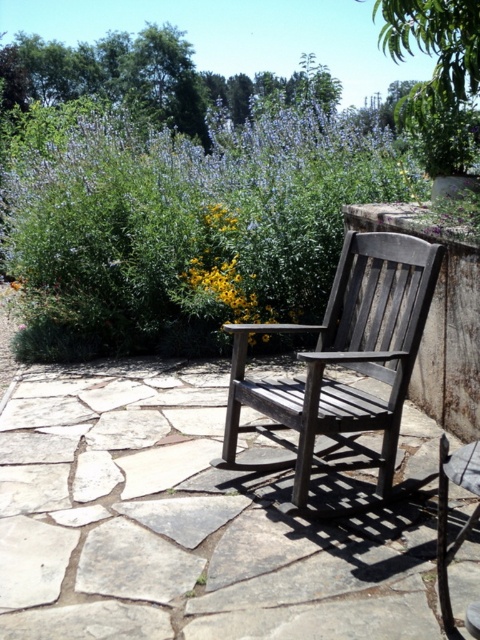
You are standing at the origin point of the image coordinate system, which is the bottom left corner. You want to walk to the dark gray wood chair at center. In which direction should you move first? Please provide your answer in terms of the coordinate system. The coordinate system has x increasing to the right and y increasing upwards. You can answer with directions like up, down, left, right, or combinations like up and right.

Since the dark gray wood chair at center is located at coordinate point (344, 362), which is to the right and above the origin, you should move in the direction of up and right to reach it.

You are standing in the garden and want to water the yellow matte flower at center. The dark gray wood chair at center is in your way. Can you move the chair to access the flower?

The dark gray wood chair at center is below the yellow matte flower at center, so you can move the chair to access the flower since it is positioned under it.

You are a gardener who wants to place a new small statue that is 1 meter tall. You see the dark gray wood chair at center and the yellow matte flower at center. Which object can the statue be placed next to without blocking the view of the other object?

The statue can be placed next to the yellow matte flower at center because the dark gray wood chair at center is taller than the yellow matte flower at center, so placing the statue next to the flower would avoid blocking the view of the chair.